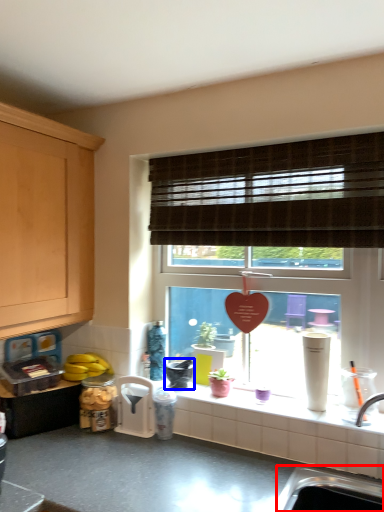
Question: Among these objects, which one is farthest to the camera, sink (highlighted by a red box) or appliance (highlighted by a blue box)?

Choices:
 (A) sink
 (B) appliance

Answer: (B)